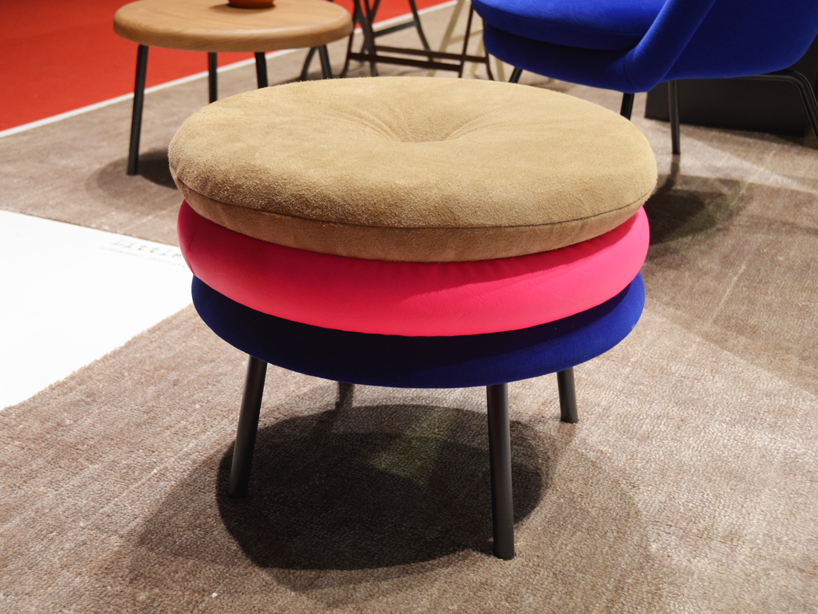
The image size is (818, 614). I want to click on table, so click(227, 24).